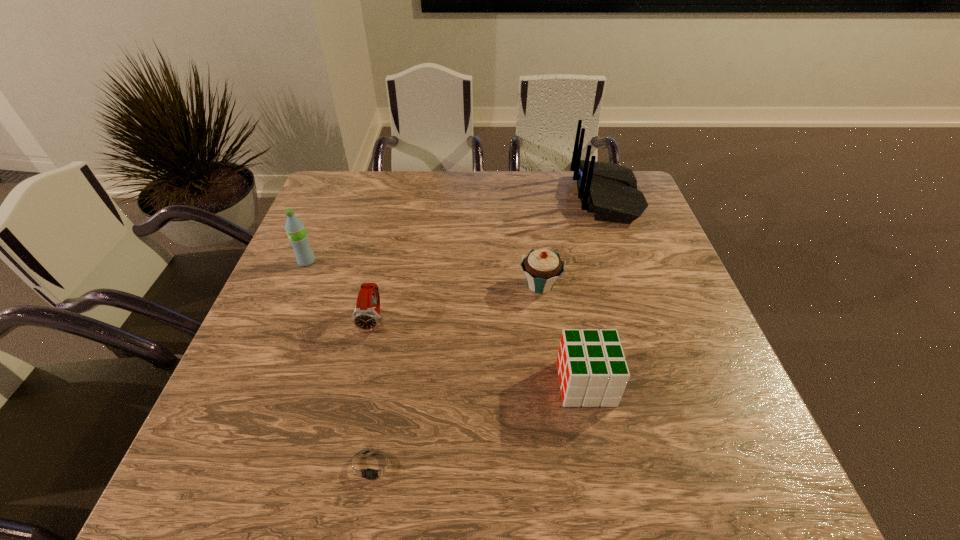
Locate an element on the screen. The width and height of the screenshot is (960, 540). free space between the water bottle and the nearer watch is located at coordinates click(341, 363).

At what (x,y) coordinates should I click in order to perform the action: click on unoccupied area between the fourth farthest object and the nearest object. Please return your answer as a coordinate pair (x, y). Image resolution: width=960 pixels, height=540 pixels. Looking at the image, I should click on (374, 393).

The width and height of the screenshot is (960, 540). I want to click on vacant region between the taller watch and the farthest object, so click(x=491, y=259).

At what (x,y) coordinates should I click in order to perform the action: click on blank region between the water bottle and the fifth farthest object. Please return your answer as a coordinate pair (x, y). The image size is (960, 540). Looking at the image, I should click on (446, 322).

Find the location of a particular element. vacant area that lies between the taller watch and the shortest object is located at coordinates (374, 393).

At what (x,y) coordinates should I click in order to perform the action: click on vacant space that's between the fifth farthest object and the fifth shortest object. Please return your answer as a coordinate pair (x, y). Looking at the image, I should click on (446, 322).

Image resolution: width=960 pixels, height=540 pixels. Identify the location of vacant space in between the third farthest object and the shortest object. (457, 375).

The image size is (960, 540). What are the coordinates of `blank region between the taller watch and the cube` in the screenshot? It's located at (480, 352).

Identify which object is the nearest to the fourth farthest object. Please provide its 2D coordinates. Your answer should be formatted as a tuple, i.e. [(x, y)], where the tuple contains the x and y coordinates of a point satisfying the conditions above.

[(295, 229)]

Identify which object is the second closest to the fifth farthest object. Please provide its 2D coordinates. Your answer should be formatted as a tuple, i.e. [(x, y)], where the tuple contains the x and y coordinates of a point satisfying the conditions above.

[(373, 467)]